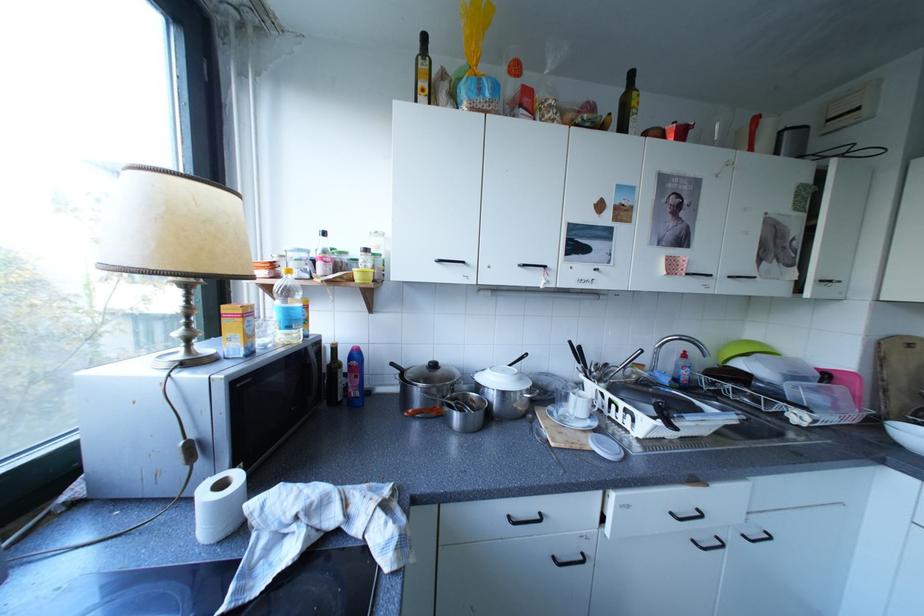
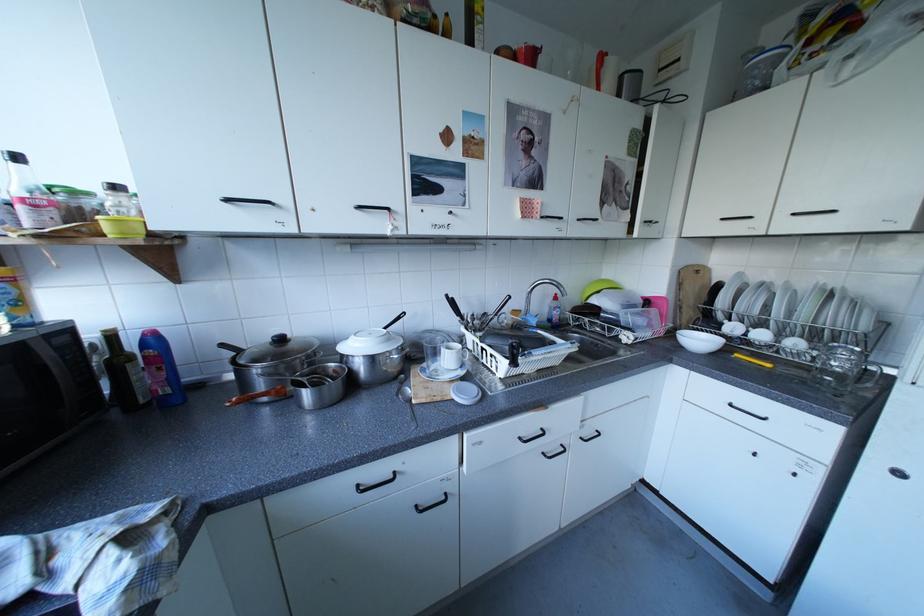
The point at (369, 354) is marked in the first image. Where is the corresponding point in the second image?

(165, 339)